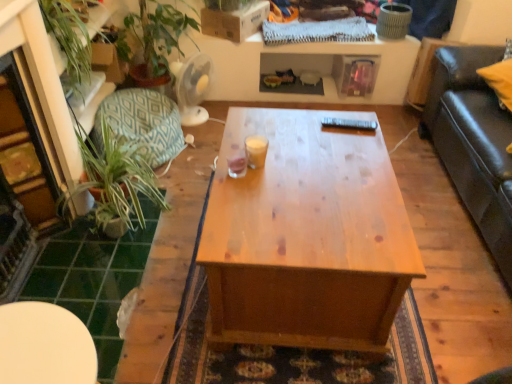
Where is `empty space that is ontop of green tile at lower left`? The height and width of the screenshot is (384, 512). empty space that is ontop of green tile at lower left is located at coordinates (87, 261).